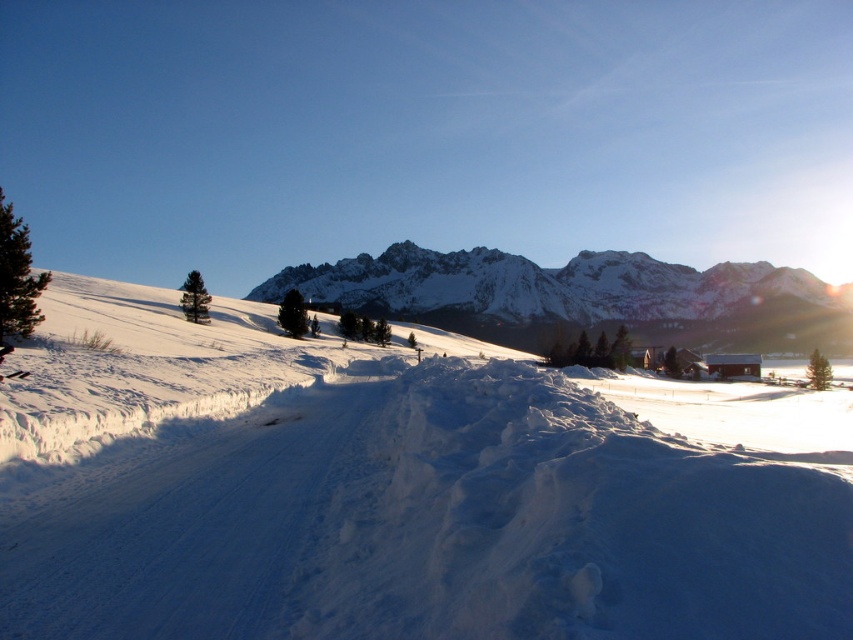
Question: Which object appears farthest from the camera in this image?

Choices:
 (A) white snow-covered mountain at center
 (B) white fluffy snow at center

Answer: (A)

Question: Is white fluffy snow at center wider than white snow-covered mountain at center?

Choices:
 (A) no
 (B) yes

Answer: (A)

Question: Where is white fluffy snow at center located in relation to white snow-covered mountain at center in the image?

Choices:
 (A) left
 (B) right

Answer: (A)

Question: Is white fluffy snow at center wider than white snow-covered mountain at center?

Choices:
 (A) yes
 (B) no

Answer: (B)

Question: Which point is farther from the camera taking this photo?

Choices:
 (A) (265, 380)
 (B) (566, 269)

Answer: (B)

Question: Among these objects, which one is nearest to the camera?

Choices:
 (A) white snow-covered mountain at center
 (B) white fluffy snow at center

Answer: (B)